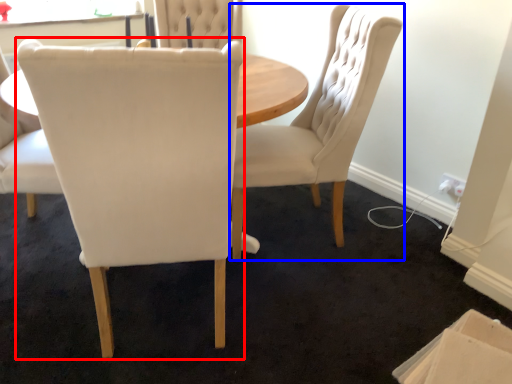
Question: Which object appears closest to the camera in this image, chair (highlighted by a red box) or chair (highlighted by a blue box)?

Choices:
 (A) chair
 (B) chair

Answer: (A)